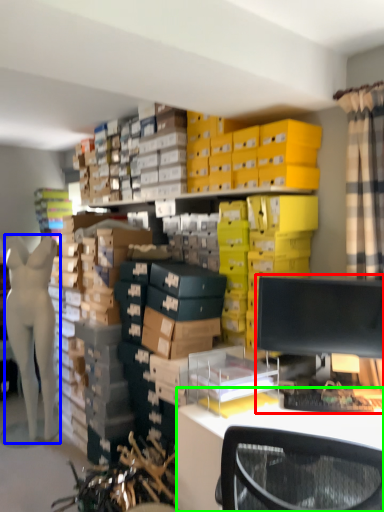
Question: Considering the real-world distances, which object is farthest from desktop computer (highlighted by a red box)? person (highlighted by a blue box) or desk (highlighted by a green box)?

Choices:
 (A) person
 (B) desk

Answer: (A)